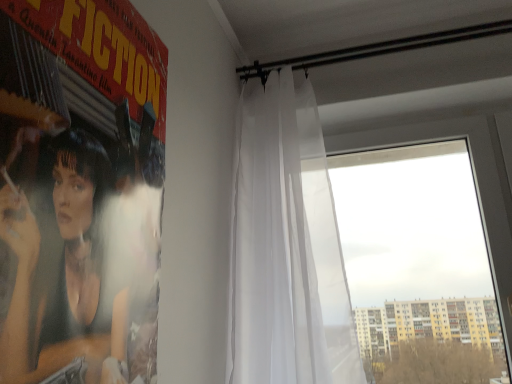
Question: From the image's perspective, would you say white sheer curtain at upper center is positioned over transparent glass window at right?

Choices:
 (A) no
 (B) yes

Answer: (B)

Question: Is white sheer curtain at upper center outside transparent glass window at right?

Choices:
 (A) yes
 (B) no

Answer: (A)

Question: Can you confirm if white sheer curtain at upper center is positioned to the right of transparent glass window at right?

Choices:
 (A) no
 (B) yes

Answer: (A)

Question: Is white sheer curtain at upper center taller than transparent glass window at right?

Choices:
 (A) yes
 (B) no

Answer: (A)

Question: Considering the relative sizes of white sheer curtain at upper center and transparent glass window at right in the image provided, is white sheer curtain at upper center bigger than transparent glass window at right?

Choices:
 (A) yes
 (B) no

Answer: (A)

Question: From the image's perspective, is matte black poster at left located above or below white sheer curtain at upper center?

Choices:
 (A) below
 (B) above

Answer: (B)

Question: Considering their positions, is matte black poster at left located in front of or behind white sheer curtain at upper center?

Choices:
 (A) front
 (B) behind

Answer: (A)

Question: From their relative heights in the image, would you say matte black poster at left is taller or shorter than white sheer curtain at upper center?

Choices:
 (A) short
 (B) tall

Answer: (A)

Question: Looking at the image, does matte black poster at left seem bigger or smaller compared to white sheer curtain at upper center?

Choices:
 (A) small
 (B) big

Answer: (A)

Question: Considering the positions of point (510, 266) and point (20, 294), is point (510, 266) closer or farther from the camera than point (20, 294)?

Choices:
 (A) closer
 (B) farther

Answer: (B)

Question: Would you say transparent glass window at right is to the left or to the right of matte black poster at left in the picture?

Choices:
 (A) left
 (B) right

Answer: (B)

Question: In the image, is transparent glass window at right positioned in front of or behind matte black poster at left?

Choices:
 (A) behind
 (B) front

Answer: (A)

Question: Considering the positions of transparent glass window at right and matte black poster at left in the image, is transparent glass window at right wider or thinner than matte black poster at left?

Choices:
 (A) wide
 (B) thin

Answer: (A)

Question: In terms of size, does transparent glass window at right appear bigger or smaller than white sheer curtain at upper center?

Choices:
 (A) small
 (B) big

Answer: (A)

Question: Does point (503, 329) appear closer or farther from the camera than point (296, 274)?

Choices:
 (A) closer
 (B) farther

Answer: (B)